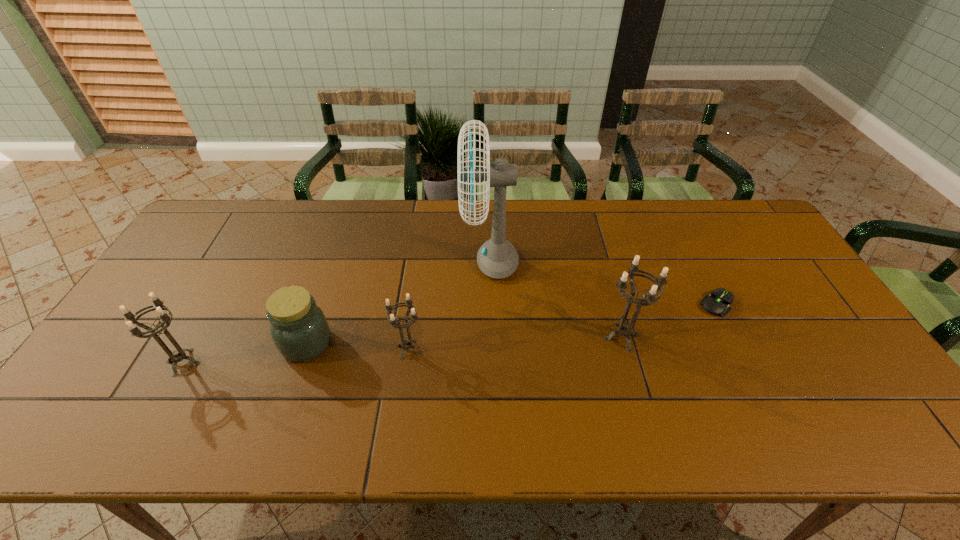
With all candle holders evenly spaced, where should an extra candle holder be placed on the right to continue the pattern? Please point out a vacant space. Please provide its 2D coordinates. Your answer should be formatted as a tuple, i.e. [(x, y)], where the tuple contains the x and y coordinates of a point satisfying the conditions above.

[(827, 326)]